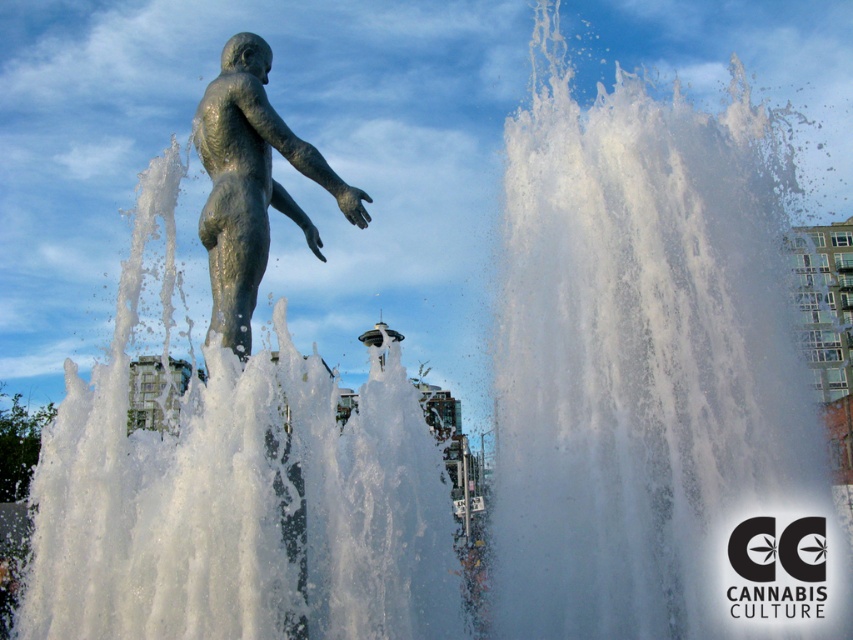
Measure the distance between point (x=834, y=634) and camera.

Point (x=834, y=634) is 24.28 meters from camera.

Does clear water at center appear under bronze textured statue at center?

Incorrect, clear water at center is not positioned below bronze textured statue at center.

What do you see at coordinates (643, 369) in the screenshot? I see `clear water at center` at bounding box center [643, 369].

Identify the location of clear water at center. (643, 369).